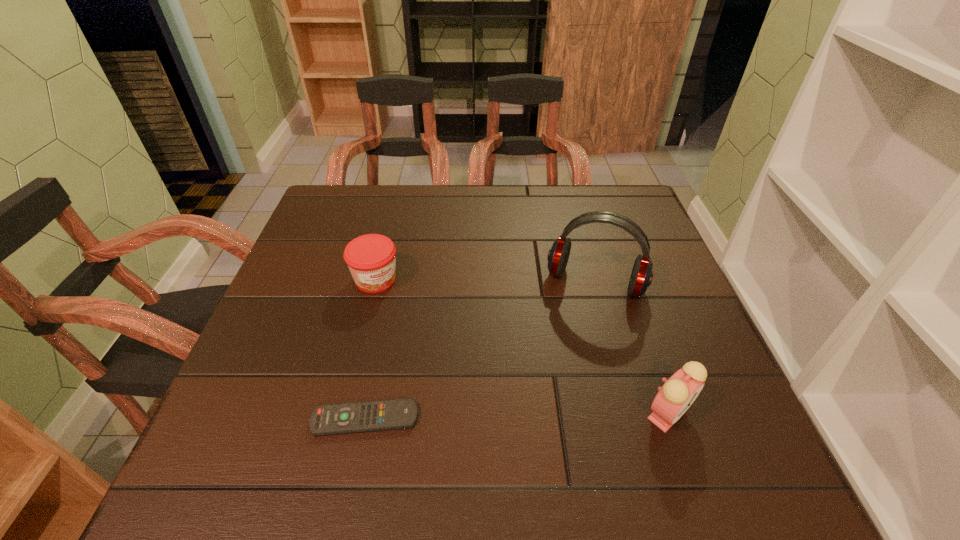
Where is `free space located on the label side of the third tallest object`? This screenshot has height=540, width=960. free space located on the label side of the third tallest object is located at coordinates (409, 315).

At what (x,y) coordinates should I click in order to perform the action: click on remote control that is at the near edge. Please return your answer as a coordinate pair (x, y). Looking at the image, I should click on (357, 417).

Where is `alarm clock that is positioned at the near edge`? This screenshot has height=540, width=960. alarm clock that is positioned at the near edge is located at coordinates (673, 399).

Locate an element on the screen. This screenshot has height=540, width=960. alarm clock present at the right edge is located at coordinates (673, 399).

Where is `earphone that is at the right edge`? This screenshot has height=540, width=960. earphone that is at the right edge is located at coordinates (641, 277).

Where is `object at the near right corner`? object at the near right corner is located at coordinates (673, 399).

The height and width of the screenshot is (540, 960). What are the coordinates of `free space at the far edge` in the screenshot? It's located at (415, 186).

Identify the location of vacant space at the left edge of the desktop. Image resolution: width=960 pixels, height=540 pixels. (285, 332).

The image size is (960, 540). I want to click on vacant space at the right edge, so click(x=649, y=340).

This screenshot has width=960, height=540. Identify the location of blank area at the far left corner. (346, 190).